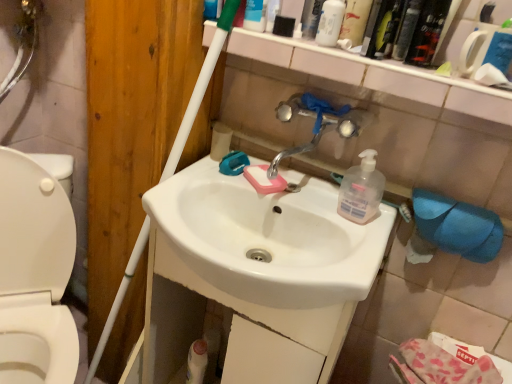
Question: Should I look upward or downward to see translucent plastic mouthwash at upper right, the 3th mouthwash positioned from the right?

Choices:
 (A) up
 (B) down

Answer: (A)

Question: Is white matte bottle at upper center, which is counted as the 1th cleaning product, starting from the top, smaller than chrome metallic faucet at center?

Choices:
 (A) no
 (B) yes

Answer: (B)

Question: Does white matte bottle at upper center, the 2th cleaning product positioned from the bottom, have a larger size compared to chrome metallic faucet at center?

Choices:
 (A) no
 (B) yes

Answer: (A)

Question: Is white matte bottle at upper center, which is counted as the 1th cleaning product, starting from the top, touching chrome metallic faucet at center?

Choices:
 (A) no
 (B) yes

Answer: (A)

Question: Can you confirm if white matte bottle at upper center, which is counted as the 1th cleaning product, starting from the top, is shorter than chrome metallic faucet at center?

Choices:
 (A) yes
 (B) no

Answer: (A)

Question: Does white matte bottle at upper center, the 2th cleaning product positioned from the bottom, have a greater height compared to chrome metallic faucet at center?

Choices:
 (A) yes
 (B) no

Answer: (B)

Question: Considering the relative sizes of white matte bottle at upper center, the 2th cleaning product positioned from the bottom, and chrome metallic faucet at center in the image provided, is white matte bottle at upper center, the 2th cleaning product positioned from the bottom, wider than chrome metallic faucet at center?

Choices:
 (A) no
 (B) yes

Answer: (A)

Question: Does blue fabric toilet paper at lower right, acting as the 2th toilet paper starting from the left, have a larger size compared to translucent plastic soap dispenser at center-right, acting as the second cleaning product starting from the top?

Choices:
 (A) no
 (B) yes

Answer: (B)

Question: Is blue fabric toilet paper at lower right, acting as the 2th toilet paper starting from the left, far from translucent plastic soap dispenser at center-right, which is counted as the first cleaning product, starting from the bottom?

Choices:
 (A) yes
 (B) no

Answer: (B)

Question: Can you confirm if blue fabric toilet paper at lower right, which is counted as the 2th toilet paper, starting from the back, is positioned to the left of translucent plastic soap dispenser at center-right, which is counted as the first cleaning product, starting from the bottom?

Choices:
 (A) no
 (B) yes

Answer: (A)

Question: From a real-world perspective, is blue fabric toilet paper at lower right, acting as the second toilet paper starting from the top, located higher than translucent plastic soap dispenser at center-right, which is counted as the first cleaning product, starting from the bottom?

Choices:
 (A) yes
 (B) no

Answer: (B)

Question: Does blue fabric toilet paper at lower right, which is the 1th toilet paper from front to back, have a lesser width compared to translucent plastic soap dispenser at center-right, which is counted as the first cleaning product, starting from the bottom?

Choices:
 (A) yes
 (B) no

Answer: (A)

Question: From the image's perspective, is blue fabric toilet paper at lower right, the 1th toilet paper when ordered from bottom to top, under translucent plastic soap dispenser at center-right, which is counted as the first cleaning product, starting from the bottom?

Choices:
 (A) no
 (B) yes

Answer: (B)

Question: Could you tell me if white matte bottle at upper center, the 2th cleaning product positioned from the bottom, is facing metallic silver faucet at upper center?

Choices:
 (A) no
 (B) yes

Answer: (A)